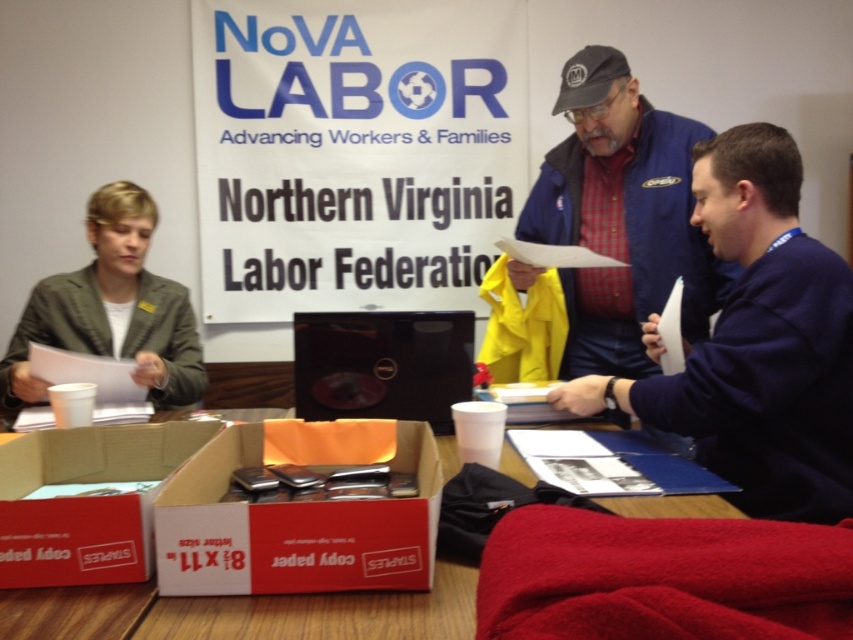
Is dark blue sweater at center to the right of white cardboard box at lower center from the viewer's perspective?

Yes, dark blue sweater at center is to the right of white cardboard box at lower center.

This screenshot has width=853, height=640. What are the coordinates of `dark blue sweater at center` in the screenshot? It's located at [758, 342].

Is white cardboard box at center shorter than white cardboard box at lower left?

Yes, white cardboard box at center is shorter than white cardboard box at lower left.

The height and width of the screenshot is (640, 853). What do you see at coordinates (241, 612) in the screenshot? I see `white cardboard box at center` at bounding box center [241, 612].

Is point (218, 602) farther from camera compared to point (91, 529)?

That is False.

Locate an element on the screen. Image resolution: width=853 pixels, height=640 pixels. white cardboard box at center is located at coordinates (241, 612).

From the picture: Is dark blue sweater at center closer to camera compared to green fabric jacket at left?

Yes, it is in front of green fabric jacket at left.

Describe the element at coordinates (758, 342) in the screenshot. This screenshot has width=853, height=640. I see `dark blue sweater at center` at that location.

Measure the distance between point (698, 456) and camera.

They are 1.58 meters apart.

Image resolution: width=853 pixels, height=640 pixels. Find the location of `dark blue sweater at center`. dark blue sweater at center is located at coordinates (758, 342).